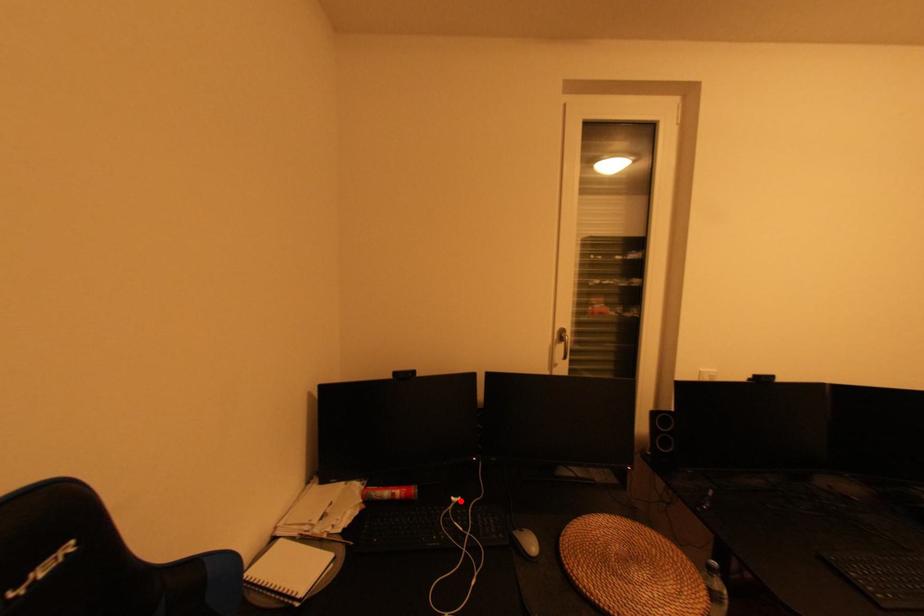
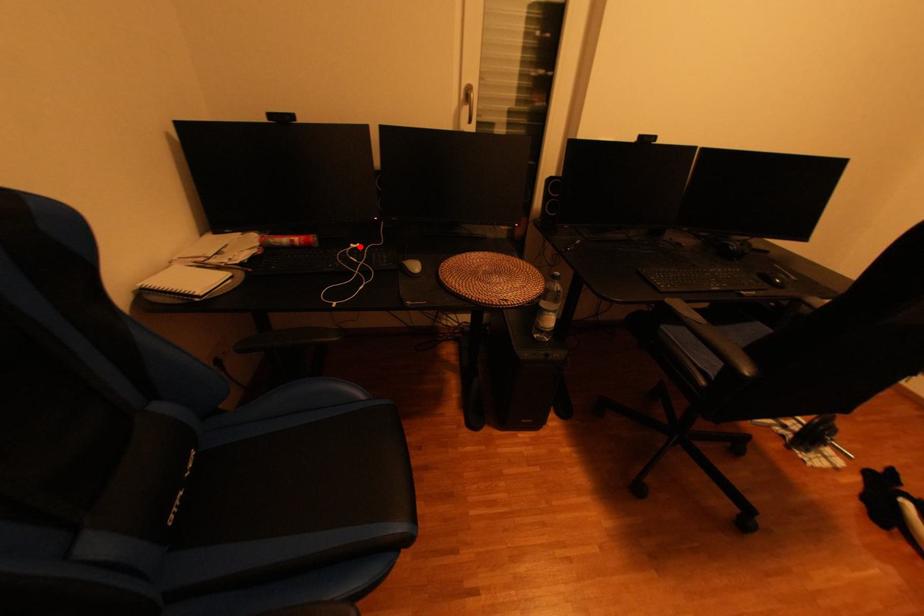
I am providing you with two images of the same scene from different viewpoints. A red point is marked on the first image and another point is marked on the second image. Do the highlighted points in image1 and image2 indicate the same real-world spot?

Yes